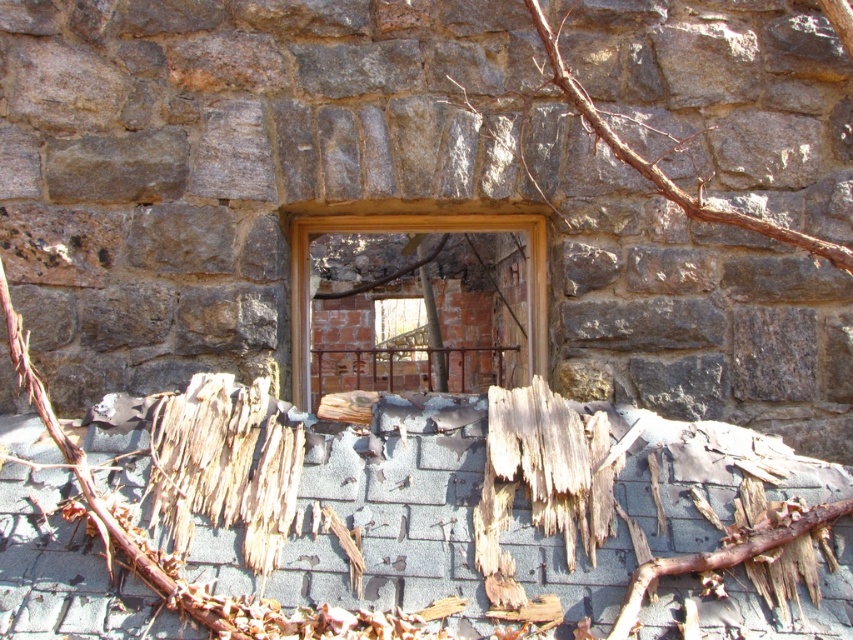
Question: Is brown shredded wood at lower left to the right of brown rough wood at lower center from the viewer's perspective?

Choices:
 (A) yes
 (B) no

Answer: (B)

Question: Estimate the real-world distances between objects in this image. Which object is farther from the brown shredded wood at lower left?

Choices:
 (A) brown rough wood at lower center
 (B) brown weathered wood at lower center
 (C) brown woody branch at upper center
 (D) wooden frame at center

Answer: (D)

Question: Which of the following is the farthest from the observer?

Choices:
 (A) [541, 467]
 (B) [212, 445]

Answer: (B)

Question: Which object is positioned farthest from the wooden frame at center?

Choices:
 (A) brown rough wood at lower center
 (B) brown shredded wood at lower left

Answer: (A)

Question: Considering the relative positions of brown shredded wood at lower left and brown woody branch at upper center in the image provided, where is brown shredded wood at lower left located with respect to brown woody branch at upper center?

Choices:
 (A) above
 (B) below

Answer: (B)

Question: Is brown shredded wood at lower left smaller than brown weathered wood at lower center?

Choices:
 (A) yes
 (B) no

Answer: (B)